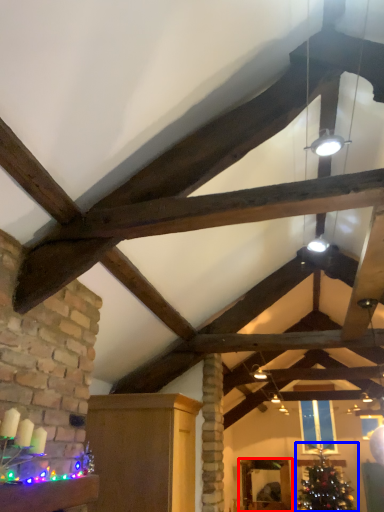
Question: Among these objects, which one is farthest to the camera, furniture (highlighted by a red box) or christmas tree (highlighted by a blue box)?

Choices:
 (A) furniture
 (B) christmas tree

Answer: (A)